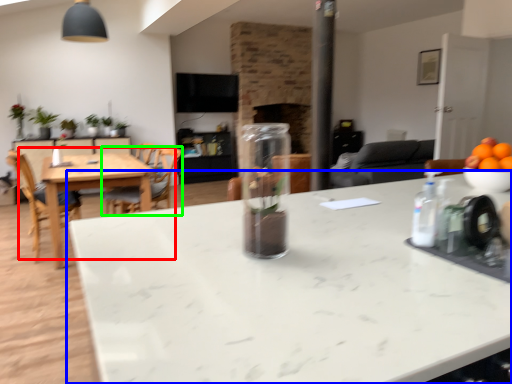
Question: Considering the real-world distances, which object is farthest from kitchen & dining room table (highlighted by a red box)? countertop (highlighted by a blue box) or chair (highlighted by a green box)?

Choices:
 (A) countertop
 (B) chair

Answer: (A)